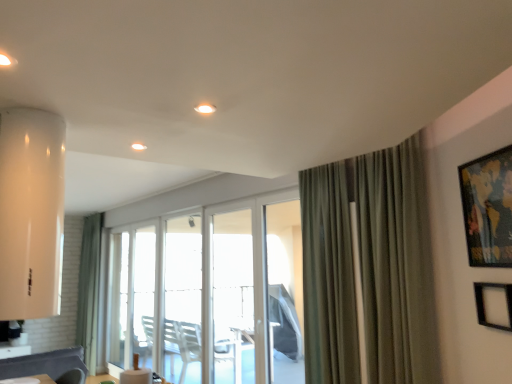
Find the location of a particular element. white glossy light fixture at upper center, which is counted as the first light, starting from the front is located at coordinates (205, 108).

What is the approximate height of white glossy light fixture at upper center, acting as the 2th light starting from the back?

It is 1.00 centimeters.

In order to face green textured curtain at right, positioned as the 1th curtain in right-to-left order, should I rotate leftwards or rightwards?

Rotate your view right by about 12.581°.

Measure the distance between green textured curtain at right, which is counted as the 1th curtain, starting from the front, and camera.

green textured curtain at right, which is counted as the 1th curtain, starting from the front, is 2.41 meters away from camera.

This screenshot has width=512, height=384. What do you see at coordinates (183, 299) in the screenshot?
I see `transparent glass window at center` at bounding box center [183, 299].

Locate an element on the screen. black matte picture frame at upper right, arranged as the second picture frame when viewed from the top is located at coordinates (494, 305).

What do you see at coordinates (89, 289) in the screenshot? The height and width of the screenshot is (384, 512). I see `green fabric curtain at left, which is the first curtain in back-to-front order` at bounding box center [89, 289].

This screenshot has height=384, width=512. In order to click on white glossy light fixture at upper center, placed as the first light when sorted from top to bottom in this screenshot , I will do `click(205, 108)`.

Considering the sizes of white glossy table at lower left and white glossy light fixture at upper center, which appears as the 1th light when viewed from the right, in the image, is white glossy table at lower left wider or thinner than white glossy light fixture at upper center, which appears as the 1th light when viewed from the right,?

In the image, white glossy table at lower left appears to be wider than white glossy light fixture at upper center, which appears as the 1th light when viewed from the right.

Looking at the image, does white glossy table at lower left seem bigger or smaller compared to white glossy light fixture at upper center, which is counted as the first light, starting from the front?

Considering their sizes, white glossy table at lower left takes up more space than white glossy light fixture at upper center, which is counted as the first light, starting from the front.

Is white glossy table at lower left oriented away from white glossy light fixture at upper center, acting as the 2th light starting from the back?

No, white glossy table at lower left is not facing away from white glossy light fixture at upper center, acting as the 2th light starting from the back.

From a real-world perspective, starting from the white glossy table at lower left, which light is the 1st one vertically above it? Please provide its 2D coordinates.

[(205, 108)]

Does wooden framed map at upper right, the first picture frame from the top, have a lesser width compared to clear glass door at center?

Yes, wooden framed map at upper right, the first picture frame from the top, is thinner than clear glass door at center.

Is there a large distance between wooden framed map at upper right, the first picture frame from the top, and clear glass door at center?

wooden framed map at upper right, the first picture frame from the top, is far away from clear glass door at center.

From a real-world perspective, is wooden framed map at upper right, marked as the second picture frame in a bottom-to-top arrangement, positioned above or below clear glass door at center?

From a real-world perspective, wooden framed map at upper right, marked as the second picture frame in a bottom-to-top arrangement, is physically above clear glass door at center.

Which is behind, point (500, 248) or point (117, 350)?

The point (117, 350) is behind.

Which object is positioned more to the right, green textured curtain at right, which is counted as the 1th curtain, starting from the front, or white glossy light at upper center, the 2th light viewed from the top?

From the viewer's perspective, green textured curtain at right, which is counted as the 1th curtain, starting from the front, appears more on the right side.

Considering the relative positions of green textured curtain at right, which is counted as the 1th curtain, starting from the front, and white glossy light at upper center, the first light from the back, in the image provided, is green textured curtain at right, which is counted as the 1th curtain, starting from the front, behind white glossy light at upper center, the first light from the back,?

No.

Between point (374, 169) and point (145, 149), which one is positioned in front?

The point (145, 149) is closer.

Is green textured curtain at right, positioned as the 1th curtain in right-to-left order, aimed at white glossy light at upper center, the 2th light viewed from the top?

Yes, green textured curtain at right, positioned as the 1th curtain in right-to-left order, faces towards white glossy light at upper center, the 2th light viewed from the top.

Considering the sizes of objects white glossy light at upper center, which is the 1th light in bottom-to-top order, and clear glass door at center in the image provided, who is bigger, white glossy light at upper center, which is the 1th light in bottom-to-top order, or clear glass door at center?

clear glass door at center is bigger.

Can you tell me how much white glossy light at upper center, which ranks as the second light in front-to-back order, and clear glass door at center differ in facing direction?

The facing directions of white glossy light at upper center, which ranks as the second light in front-to-back order, and clear glass door at center are 89.8 degrees apart.

Relative to clear glass door at center, is white glossy light at upper center, placed as the 1th light when sorted from left to right, in front or behind?

In the image, white glossy light at upper center, placed as the 1th light when sorted from left to right, appears in front of clear glass door at center.

In terms of height, does green fabric curtain at left, the second curtain from the front, look taller or shorter compared to white glossy table at lower left?

Clearly, green fabric curtain at left, the second curtain from the front, is taller compared to white glossy table at lower left.

Does point (99, 246) come farther from viewer compared to point (42, 377)?

Yes, it is behind point (42, 377).

Is green fabric curtain at left, which appears as the second curtain when viewed from the right, at the left side of white glossy table at lower left?

Correct, you'll find green fabric curtain at left, which appears as the second curtain when viewed from the right, to the left of white glossy table at lower left.

Is green fabric curtain at left, which is the first curtain in back-to-front order, located outside white glossy table at lower left?

Yes, green fabric curtain at left, which is the first curtain in back-to-front order, is outside of white glossy table at lower left.

Is white glossy light at upper center, which ranks as the second light in front-to-back order, spatially inside white glossy light fixture at upper center, the second light from the bottom, or outside of it?

white glossy light at upper center, which ranks as the second light in front-to-back order, exists outside the volume of white glossy light fixture at upper center, the second light from the bottom.

Is the position of white glossy light at upper center, the 2th light viewed from the top, more distant than that of white glossy light fixture at upper center, the second light from the bottom?

Yes, the depth of white glossy light at upper center, the 2th light viewed from the top, is greater than that of white glossy light fixture at upper center, the second light from the bottom.

From the image's perspective, between white glossy light at upper center, the 2th light viewed from the top, and white glossy light fixture at upper center, which is counted as the first light, starting from the front, who is located below?

white glossy light at upper center, the 2th light viewed from the top.

From a real-world perspective, is white glossy light at upper center, acting as the 2th light starting from the right, positioned above or below white glossy light fixture at upper center, which is the 2th light from left to right?

From a real-world perspective, white glossy light at upper center, acting as the 2th light starting from the right, is physically above white glossy light fixture at upper center, which is the 2th light from left to right.

Identify the location of table located underneath the transparent glass window at center (from a real-world perspective). (29, 380).

Would you say white glossy table at lower left is part of transparent glass window at center's contents?

No, transparent glass window at center does not contain white glossy table at lower left.

Is transparent glass window at center placed right next to white glossy table at lower left?

No, transparent glass window at center is not making contact with white glossy table at lower left.

Does point (183, 244) come in front of point (21, 379)?

No, it is not.

At what (x,y) coordinates should I click in order to perform the action: click on the 2nd light in front when counting from the white glossy table at lower left. Please return your answer as a coordinate pair (x, y). The width and height of the screenshot is (512, 384). Looking at the image, I should click on click(x=205, y=108).

Identify the location of glass door that appears below the wooden framed map at upper right, marked as the second picture frame in a bottom-to-top arrangement (from a real-world perspective). (132, 296).

Looking at the image, which one is located further to black matte picture frame at upper right, arranged as the second picture frame when viewed from the top, white glossy table at lower left or white glossy light at upper center, acting as the 2th light starting from the right?

Among the two, white glossy table at lower left is located further to black matte picture frame at upper right, arranged as the second picture frame when viewed from the top.

Which object lies nearer to the anchor point white glossy light fixture at upper center, which is the 2th light from left to right, clear glass screen door at center, which is the second screen door in right-to-left order, or white glossy table at lower left?

clear glass screen door at center, which is the second screen door in right-to-left order, is closer to white glossy light fixture at upper center, which is the 2th light from left to right.

When comparing their distances from green textured curtain at right, which ranks as the 2th curtain in back-to-front order, does white glossy light at upper center, placed as the 1th light when sorted from left to right, or wooden framed map at upper right, the first picture frame from the top, seem further?

The object further to green textured curtain at right, which ranks as the 2th curtain in back-to-front order, is white glossy light at upper center, placed as the 1th light when sorted from left to right.

Estimate the real-world distances between objects in this image. Which object is further from green textured curtain at right, which ranks as the 2th curtain in back-to-front order, clear glass screen door at center, which is the second screen door in right-to-left order, or wooden framed map at upper right, marked as the second picture frame in a bottom-to-top arrangement?

The object further to green textured curtain at right, which ranks as the 2th curtain in back-to-front order, is clear glass screen door at center, which is the second screen door in right-to-left order.

Consider the image. When comparing their distances from wooden framed map at upper right, the first picture frame from the top, does white glossy light at upper center, the first light from the back, or white glossy table at lower left seem closer?

white glossy light at upper center, the first light from the back, is closer to wooden framed map at upper right, the first picture frame from the top.

Which object lies nearer to the anchor point clear glass door at center, white glossy table at lower left or green textured curtain at right, the second curtain from the left?

white glossy table at lower left.

When comparing their distances from clear glass door at center, does wooden framed map at upper right, marked as the second picture frame in a bottom-to-top arrangement, or transparent glass window at center seem further?

The object further to clear glass door at center is wooden framed map at upper right, marked as the second picture frame in a bottom-to-top arrangement.

Which object lies further to the anchor point clear glass door at center, clear glass screen door at center, the 1th screen door in the left-to-right sequence, or wooden framed map at upper right, marked as the second picture frame in a bottom-to-top arrangement?

The object further to clear glass door at center is wooden framed map at upper right, marked as the second picture frame in a bottom-to-top arrangement.

Identify the location of curtain between white glossy light fixture at upper center, placed as the first light when sorted from top to bottom, and clear glass screen door at center, the 1th screen door in the left-to-right sequence, in the front-back direction. (396, 265).

Where is `table between wooden framed map at upper right, the first picture frame from the top, and green fabric curtain at left, which is the first curtain in back-to-front order, from front to back`? table between wooden framed map at upper right, the first picture frame from the top, and green fabric curtain at left, which is the first curtain in back-to-front order, from front to back is located at coordinates (29, 380).

This screenshot has width=512, height=384. Identify the location of window between green textured curtain at right, which is counted as the 1th curtain, starting from the front, and clear glass door at center from front to back. (183, 299).

The height and width of the screenshot is (384, 512). I want to click on curtain between white glossy light fixture at upper center, which appears as the 1th light when viewed from the right, and transparent plastic screen door at center, arranged as the second screen door when viewed from the left, in the front-back direction, so click(x=396, y=265).